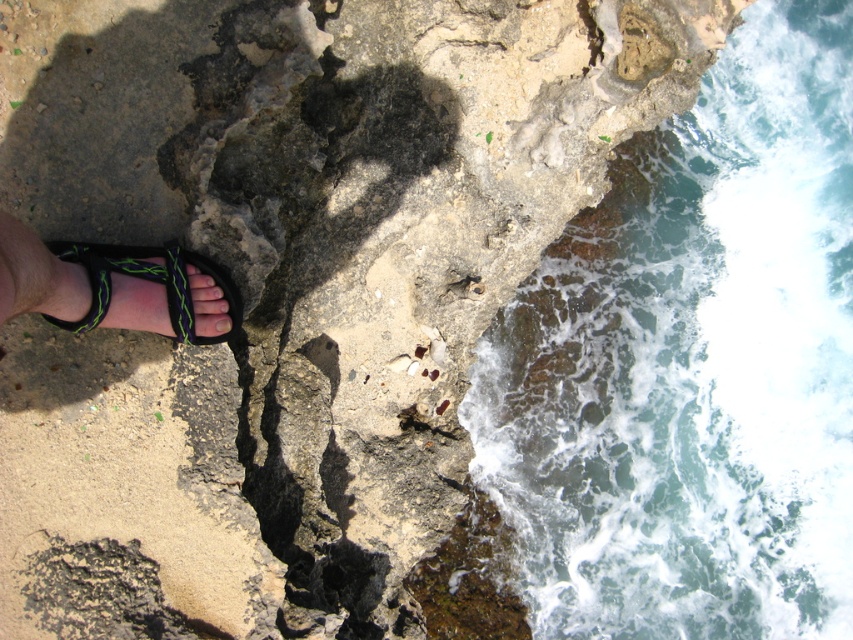
You are standing on the rocky shoreline and want to place a small seashell between the clear water at lower right and the pale yellow nail at lower left. Which side should you place it closer to to ensure it stays within the wider area?

The clear water at lower right has a larger width than the pale yellow nail at lower left, so placing the seashell closer to the clear water at lower right ensures it stays within the wider area.